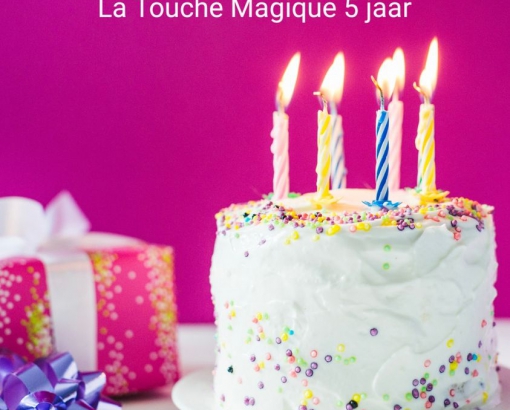
You are a GUI agent. You are given a task and a screenshot of the screen. Output one action in this format:
    pyautogui.click(x=<x>, y=<y>)
    Task: Click on the candles
    The height and width of the screenshot is (410, 510).
    Given the screenshot: What is the action you would take?
    pyautogui.click(x=280, y=140), pyautogui.click(x=318, y=167), pyautogui.click(x=337, y=170), pyautogui.click(x=378, y=173), pyautogui.click(x=396, y=166), pyautogui.click(x=423, y=174)